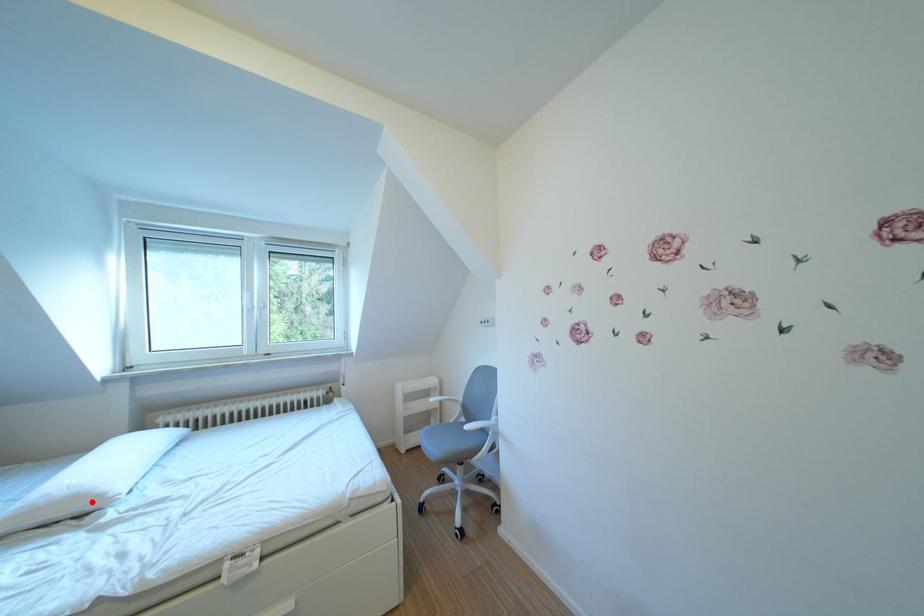
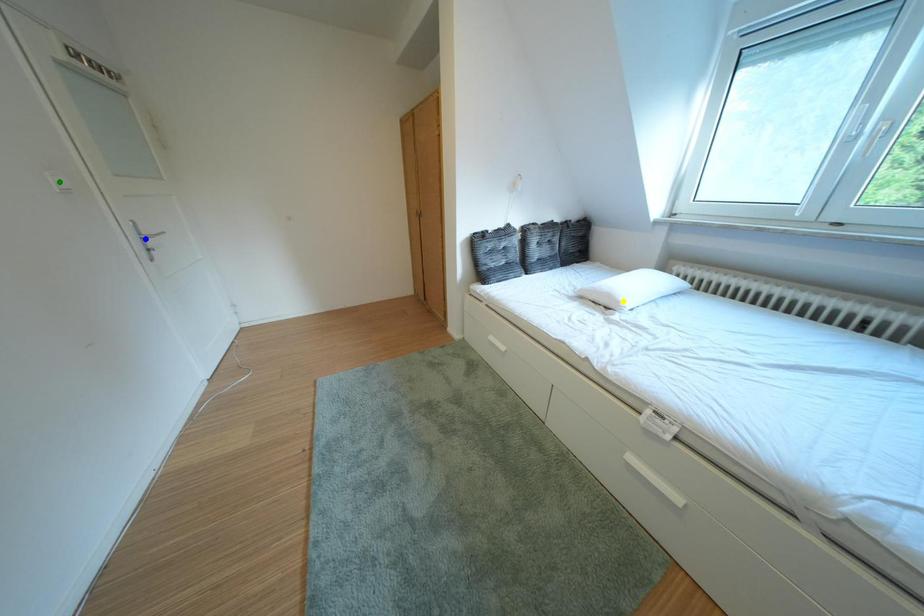
Question: I am providing you with two images of the same scene from different viewpoints. A red point is marked on the first image. You are given multiple points on the second image. Which point in image 2 represents the same 3d spot as the red point in image 1?

Choices:
 (A) blue point
 (B) green point
 (C) yellow point

Answer: (C)